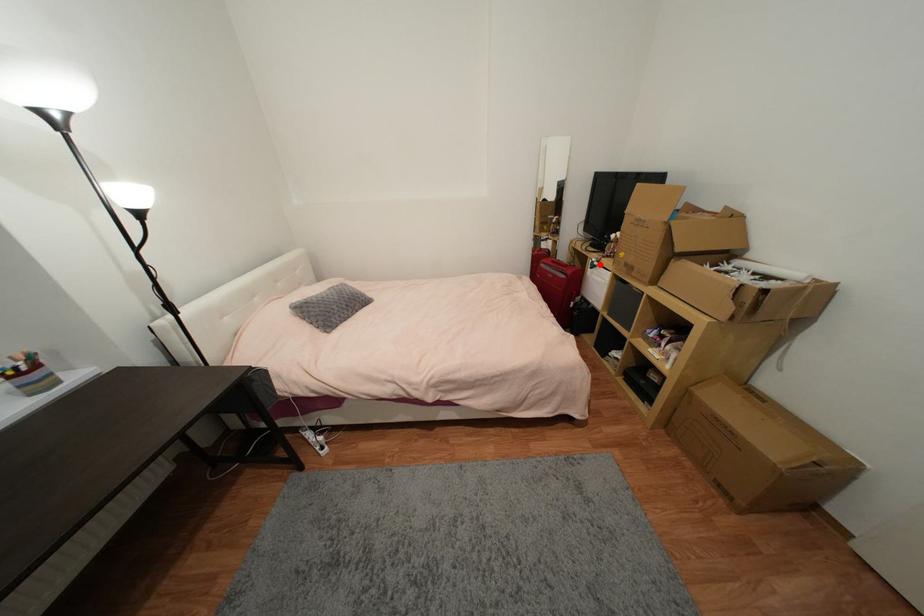
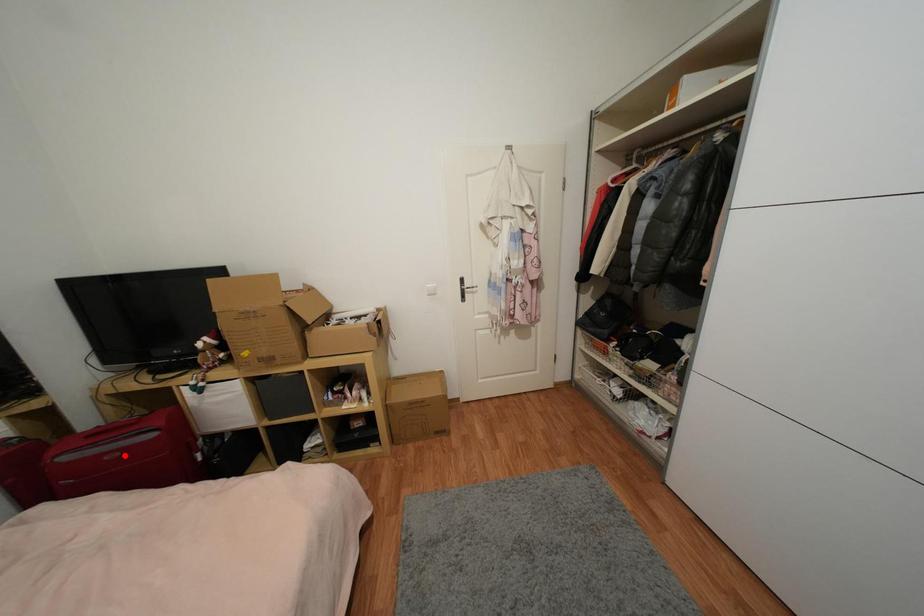
I am providing you with two images of the same scene from different viewpoints. A red point is marked on the first image and another point is marked on the second image. Do the highlighted points in image1 and image2 indicate the same real-world spot?

No